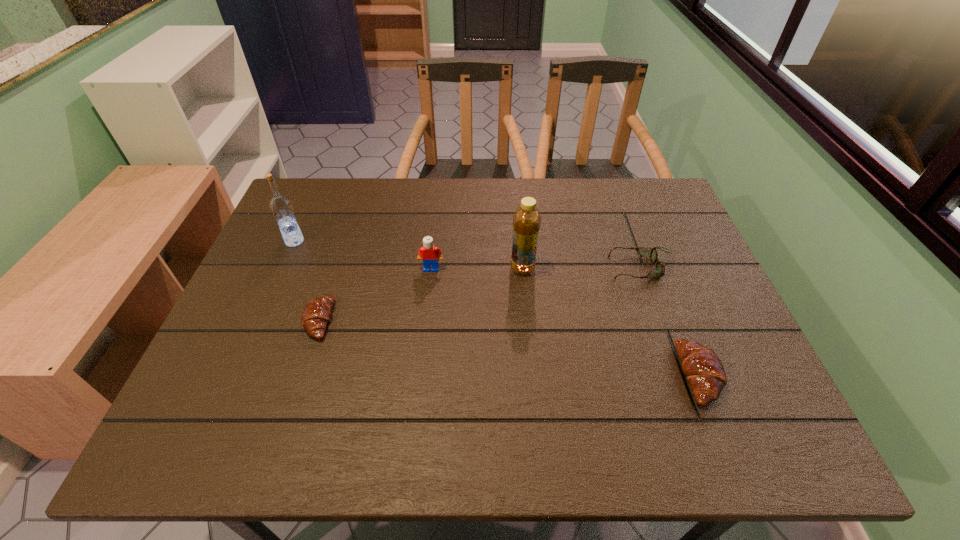
This screenshot has width=960, height=540. I want to click on crescent roll present at the right edge, so click(702, 367).

I want to click on spectacles located at the right edge, so click(x=659, y=270).

Where is `object that is positioned at the near right corner`? The width and height of the screenshot is (960, 540). object that is positioned at the near right corner is located at coordinates (702, 367).

The height and width of the screenshot is (540, 960). In order to click on vacant space at the far edge in this screenshot , I will do coord(485,219).

This screenshot has width=960, height=540. In order to click on vacant region at the near edge of the desktop in this screenshot , I will do `click(548, 397)`.

Locate an element on the screen. vacant space at the right edge of the desktop is located at coordinates (659, 286).

Identify the location of blank space at the far right corner of the desktop. (619, 190).

Where is `vacant region between the spectacles and the taller crescent roll`? This screenshot has width=960, height=540. vacant region between the spectacles and the taller crescent roll is located at coordinates (670, 321).

The width and height of the screenshot is (960, 540). Find the location of `vacant area that lies between the spectacles and the third shortest object`. vacant area that lies between the spectacles and the third shortest object is located at coordinates (670, 321).

Where is `vacant area that lies between the fourth object from right to left and the bottle`? The width and height of the screenshot is (960, 540). vacant area that lies between the fourth object from right to left and the bottle is located at coordinates (477, 268).